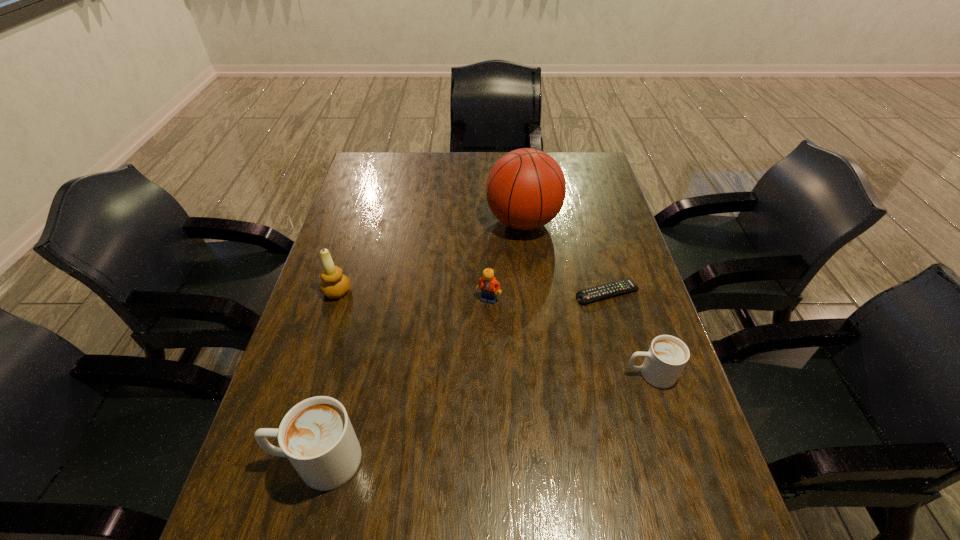
I want to click on vacant space located on the side with the handle of the fifth farthest object, so click(470, 374).

Image resolution: width=960 pixels, height=540 pixels. What are the coordinates of `vacant space located 0.140m on the side with the handle of the fifth farthest object` in the screenshot? It's located at pyautogui.click(x=564, y=374).

Find the location of `vacant space located 0.130m on the front of the tallest object`. vacant space located 0.130m on the front of the tallest object is located at coordinates (529, 276).

Locate an element on the screen. Image resolution: width=960 pixels, height=540 pixels. vacant region located 0.150m on the back of the candle_holder is located at coordinates (351, 246).

Locate an element on the screen. This screenshot has height=540, width=960. vacant space situated on the front-facing side of the third shortest object is located at coordinates (490, 341).

Find the location of a particular element. The image size is (960, 540). vacant region located on the left of the remote control is located at coordinates (553, 294).

In order to click on object at the near edge in this screenshot , I will do `click(316, 435)`.

Find the location of a particular element. The image size is (960, 540). cappuccino at the left edge is located at coordinates (316, 435).

The image size is (960, 540). In order to click on candle_holder at the left edge in this screenshot , I will do `click(334, 284)`.

This screenshot has width=960, height=540. I want to click on cappuccino that is positioned at the right edge, so point(667,356).